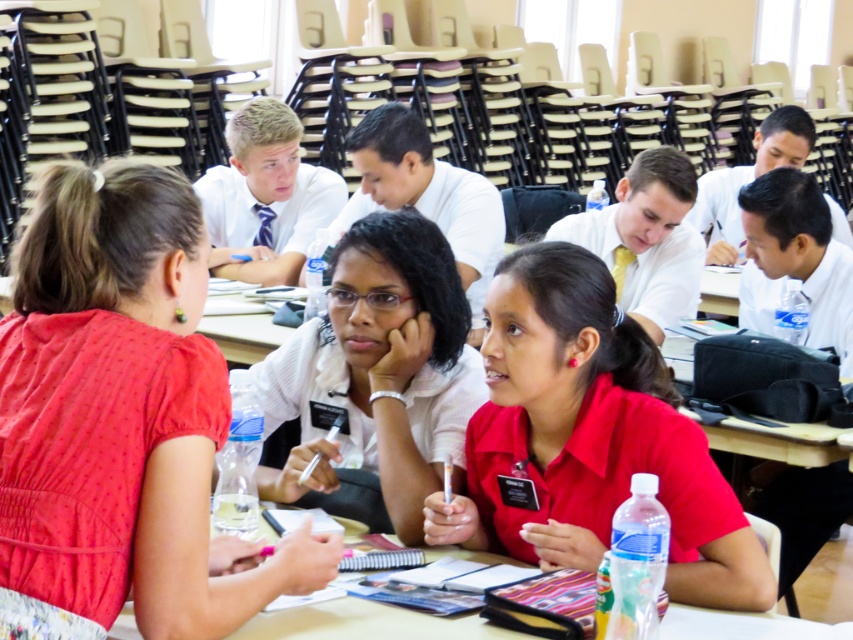
Who is lower down, smooth wooden table at center or matte white shirt at center?

smooth wooden table at center is lower down.

Who is more distant from viewer, (120, 628) or (633, 308)?

The point (633, 308) is more distant.

Between point (329, 612) and point (582, 237), which one is positioned in front?

Positioned in front is point (329, 612).

Image resolution: width=853 pixels, height=640 pixels. Identify the location of smooth wooden table at center. (782, 604).

Does point (200, 346) come behind point (302, 168)?

No, it is not.

Can you confirm if matte red blouse at center is positioned above white glossy shirt at upper center?

No, matte red blouse at center is not above white glossy shirt at upper center.

Which is in front, point (146, 323) or point (328, 204)?

Point (146, 323) is in front.

What are the coordinates of `matte red blouse at center` in the screenshot? It's located at (120, 413).

Is matte red blouse at center to the right of smooth wooden table at center from the viewer's perspective?

No, matte red blouse at center is not to the right of smooth wooden table at center.

Locate an element on the screen. matte red blouse at center is located at coordinates (120, 413).

What do you see at coordinates (120, 413) in the screenshot? I see `matte red blouse at center` at bounding box center [120, 413].

Where is `matte red blouse at center`? This screenshot has height=640, width=853. matte red blouse at center is located at coordinates (120, 413).